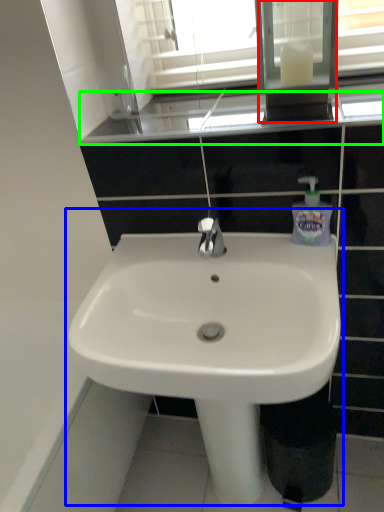
Question: Based on their relative distances, which object is nearer to medicine cabinet (highlighted by a red box)? Choose from sink (highlighted by a blue box) and window sill (highlighted by a green box).

Choices:
 (A) sink
 (B) window sill

Answer: (B)